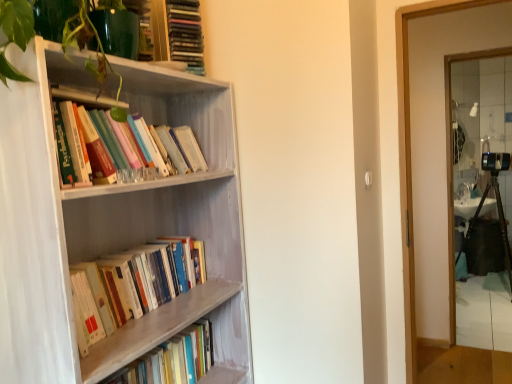
Identify the location of vacant region above clear glass mirror at right (from a real-world perspective). The height and width of the screenshot is (384, 512). (490, 52).